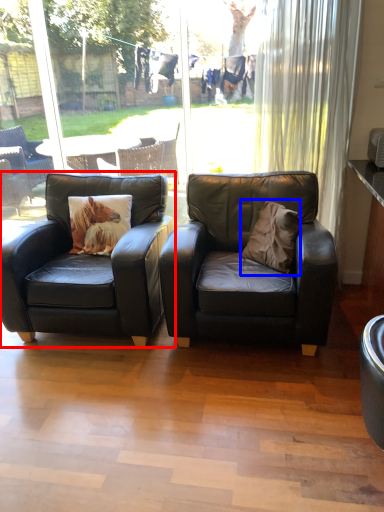
Question: Among these objects, which one is nearest to the camera, chair (highlighted by a red box) or throw pillow (highlighted by a blue box)?

Choices:
 (A) chair
 (B) throw pillow

Answer: (A)